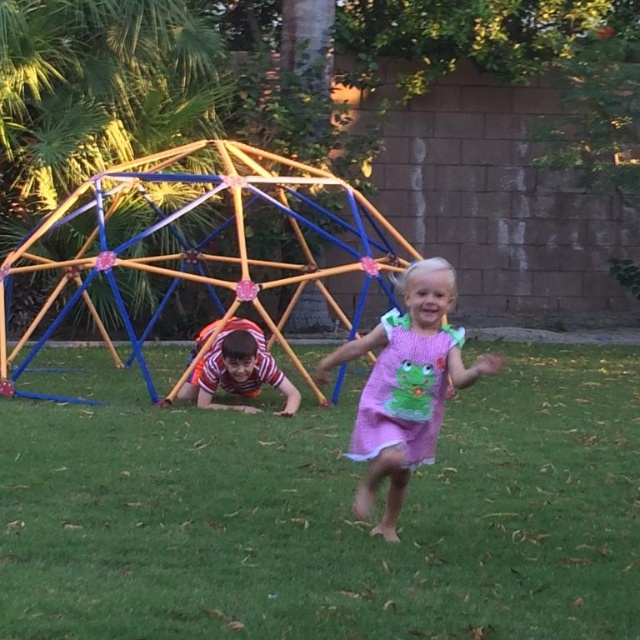
Is green grass at center thinner than pink fabric dress at center?

Incorrect, green grass at center's width is not less than pink fabric dress at center's.

Is point (177, 579) positioned before point (392, 508)?

Yes, it is.

Find the location of a particular element. Image resolution: width=640 pixels, height=640 pixels. green grass at center is located at coordinates (323, 513).

Does metallic/plastic dome at upper center have a lesser width compared to pink fabric dress at center?

No, metallic/plastic dome at upper center is not thinner than pink fabric dress at center.

Is point (83, 397) more distant than point (390, 531)?

Yes, it is behind point (390, 531).

I want to click on metallic/plastic dome at upper center, so (196, 250).

Does green grass at center have a greater height compared to metallic/plastic dome at upper center?

No.

Describe the element at coordinates (323, 513) in the screenshot. I see `green grass at center` at that location.

At what (x,y) coordinates should I click in order to perform the action: click on green grass at center. Please return your answer as a coordinate pair (x, y). Image resolution: width=640 pixels, height=640 pixels. Looking at the image, I should click on (323, 513).